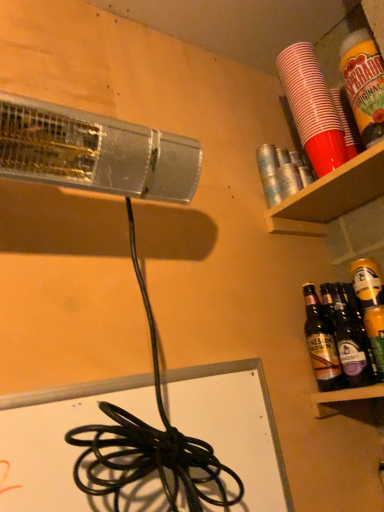
Image resolution: width=384 pixels, height=512 pixels. What do you see at coordinates (312, 108) in the screenshot?
I see `red plastic cups at upper right, which appears as the first beverage when viewed from the back` at bounding box center [312, 108].

This screenshot has height=512, width=384. Find the location of `gold matte can at right`. gold matte can at right is located at coordinates (367, 283).

What is the approximate width of red plastic cups at upper right?

The width of red plastic cups at upper right is 9.03 inches.

The height and width of the screenshot is (512, 384). What are the coordinates of `dark brown glass bottle at lower right, the 2th bottle in the left-to-right sequence` in the screenshot? It's located at (351, 342).

Where is `brown glass bottles at right, the 2th bottle when ordered from right to left`? The image size is (384, 512). brown glass bottles at right, the 2th bottle when ordered from right to left is located at coordinates (321, 344).

The image size is (384, 512). In order to click on red plastic cups at upper right, which appears as the first beverage when viewed from the back in this screenshot , I will do `click(312, 108)`.

From a real-world perspective, who is located lower, red plastic cups at upper right or gold matte can at right?

From a 3D spatial view, gold matte can at right is below.

Which of these two, red plastic cups at upper right or gold matte can at right, stands shorter?

With less height is red plastic cups at upper right.

How much distance is there between red plastic cups at upper right and gold matte can at right?

red plastic cups at upper right is 20.60 centimeters from gold matte can at right.

Which point is more distant from viewer, (315, 201) or (369, 298)?

Positioned behind is point (315, 201).

Is dark brown glass bottle at lower right, the 2th bottle in the left-to-right sequence, thinner than red plastic cups at upper right, the 2th beverage positioned from the front?

Yes.

Could you tell me if dark brown glass bottle at lower right, the 2th bottle in the left-to-right sequence, is turned towards red plastic cups at upper right, the 2th beverage positioned from the front?

No.

Which is in front, point (369, 377) or point (338, 137)?

The point (369, 377) is more forward.

Would you say dark brown glass bottle at lower right, the 2th bottle in the left-to-right sequence, is outside red plastic cups at upper right, the 2th beverage positioned from the front?

Absolutely, dark brown glass bottle at lower right, the 2th bottle in the left-to-right sequence, is external to red plastic cups at upper right, the 2th beverage positioned from the front.

Can you confirm if red plastic cups at upper right, the 2th beverage positioned from the front, is positioned to the left of red plastic cups at upper right?

Indeed, red plastic cups at upper right, the 2th beverage positioned from the front, is positioned on the left side of red plastic cups at upper right.

From the image's perspective, does red plastic cups at upper right, the 2th beverage positioned from the front, appear higher than red plastic cups at upper right?

Correct, red plastic cups at upper right, the 2th beverage positioned from the front, appears higher than red plastic cups at upper right in the image.

From the picture: Can you confirm if red plastic cups at upper right, the 2th beverage positioned from the front, is shorter than red plastic cups at upper right?

No, red plastic cups at upper right, the 2th beverage positioned from the front, is not shorter than red plastic cups at upper right.

Who is bigger, red plastic cups at upper right, the 2th beverage positioned from the front, or red plastic cups at upper right?

red plastic cups at upper right.

Does brown glass bottles at right, arranged as the first bottle when viewed from the left, have a lesser height compared to gold matte can at right?

No.

This screenshot has width=384, height=512. In the image, there is a brown glass bottles at right, the 2th bottle when ordered from right to left. What are the coordinates of `beer above it (from the image's perspective)` in the screenshot? It's located at point(367,283).

Does point (342, 383) come farther from viewer compared to point (382, 301)?

Yes, point (342, 383) is farther from viewer.

Does brown glass bottles at right, the 2th bottle when ordered from right to left, turn towards gold matte can at right?

No, brown glass bottles at right, the 2th bottle when ordered from right to left, is not facing towards gold matte can at right.

Considering the sizes of objects dark brown glass bottle at lower right, the first bottle from the right, and brown glass bottles at right, arranged as the first bottle when viewed from the left, in the image provided, who is wider, dark brown glass bottle at lower right, the first bottle from the right, or brown glass bottles at right, arranged as the first bottle when viewed from the left,?

With larger width is dark brown glass bottle at lower right, the first bottle from the right.

How much distance is there between dark brown glass bottle at lower right, the first bottle from the right, and brown glass bottles at right, arranged as the first bottle when viewed from the left?

The distance of dark brown glass bottle at lower right, the first bottle from the right, from brown glass bottles at right, arranged as the first bottle when viewed from the left, is 1.68 inches.

Based on the photo, from a real-world perspective, is dark brown glass bottle at lower right, the 2th bottle in the left-to-right sequence, below brown glass bottles at right, arranged as the first bottle when viewed from the left?

Yes, from a real-world perspective, dark brown glass bottle at lower right, the 2th bottle in the left-to-right sequence, is below brown glass bottles at right, arranged as the first bottle when viewed from the left.

Do you think gold matte can at right is within dark brown glass bottle at lower right, the first bottle from the right, or outside of it?

The correct answer is: outside.

From the image's perspective, is gold matte can at right above or below dark brown glass bottle at lower right, the 2th bottle in the left-to-right sequence?

From the image's perspective, gold matte can at right appears above dark brown glass bottle at lower right, the 2th bottle in the left-to-right sequence.

Is gold matte can at right looking in the opposite direction of dark brown glass bottle at lower right, the 2th bottle in the left-to-right sequence?

No.

Is gold matte can at right not close to dark brown glass bottle at lower right, the first bottle from the right?

No, gold matte can at right is not far away from dark brown glass bottle at lower right, the first bottle from the right.

Identify the location of shelf on the right of brown glass bottles at right, arranged as the first bottle when viewed from the left. (330, 196).

Is red plastic cups at upper right completely or partially outside of brown glass bottles at right, arranged as the first bottle when viewed from the left?

That's correct, red plastic cups at upper right is outside of brown glass bottles at right, arranged as the first bottle when viewed from the left.

Is the surface of red plastic cups at upper right in direct contact with brown glass bottles at right, arranged as the first bottle when viewed from the left?

No, red plastic cups at upper right is not next to brown glass bottles at right, arranged as the first bottle when viewed from the left.

The width and height of the screenshot is (384, 512). I want to click on shelf on the left of the gold matte can at right, so click(330, 196).

From a real-world perspective, starting from the red plastic cups at upper right, the 2th beverage positioned from the front, which bottle is the 2nd one below it? Please provide its 2D coordinates.

[(351, 342)]

Estimate the real-world distances between objects in this image. Which object is closer to dark brown glass bottle at lower right, the 2th bottle in the left-to-right sequence, red plastic cups at upper right, the 2th beverage positioned from the front, or gold matte can at right?

Among the two, gold matte can at right is located nearer to dark brown glass bottle at lower right, the 2th bottle in the left-to-right sequence.

When comparing their distances from orange plastic cup at upper right, the second beverage positioned from the back, does brown glass bottles at right, the 2th bottle when ordered from right to left, or red plastic cups at upper right seem further?

The object further to orange plastic cup at upper right, the second beverage positioned from the back, is brown glass bottles at right, the 2th bottle when ordered from right to left.

Looking at the image, which one is located further to gold matte can at right, brown glass bottles at right, arranged as the first bottle when viewed from the left, or red plastic cups at upper right, which appears as the first beverage when viewed from the back?

Among the two, red plastic cups at upper right, which appears as the first beverage when viewed from the back, is located further to gold matte can at right.

From the image, which object appears to be nearer to dark brown glass bottle at lower right, the 2th bottle in the left-to-right sequence, orange plastic cup at upper right, which is counted as the 1th beverage, starting from the front, or gold matte can at right?

gold matte can at right lies closer to dark brown glass bottle at lower right, the 2th bottle in the left-to-right sequence, than the other object.

Which object lies further to the anchor point gold matte can at right, orange plastic cup at upper right, the second beverage positioned from the back, or red plastic cups at upper right, which appears as the first beverage when viewed from the back?

red plastic cups at upper right, which appears as the first beverage when viewed from the back, lies further to gold matte can at right than the other object.

Estimate the real-world distances between objects in this image. Which object is further from dark brown glass bottle at lower right, the 2th bottle in the left-to-right sequence, orange plastic cup at upper right, the second beverage positioned from the back, or red plastic cups at upper right, the 2th beverage positioned from the front?

orange plastic cup at upper right, the second beverage positioned from the back, is positioned further to the anchor dark brown glass bottle at lower right, the 2th bottle in the left-to-right sequence.

Estimate the real-world distances between objects in this image. Which object is closer to brown glass bottles at right, the 2th bottle when ordered from right to left, gold matte can at right or red plastic cups at upper right, which appears as the first beverage when viewed from the back?

gold matte can at right lies closer to brown glass bottles at right, the 2th bottle when ordered from right to left, than the other object.

Looking at the image, which one is located closer to red plastic cups at upper right, red plastic cups at upper right, the 2th beverage positioned from the front, or gold matte can at right?

Among the two, red plastic cups at upper right, the 2th beverage positioned from the front, is located nearer to red plastic cups at upper right.

Identify the location of bottle between red plastic cups at upper right, the 2th beverage positioned from the front, and brown glass bottles at right, the 2th bottle when ordered from right to left, vertically. (351, 342).

Find the location of a particular element. This screenshot has width=384, height=512. beverage between orange plastic cup at upper right, the second beverage positioned from the back, and gold matte can at right in the up-down direction is located at coordinates (312, 108).

The width and height of the screenshot is (384, 512). In order to click on beverage that lies between orange plastic cup at upper right, the second beverage positioned from the back, and red plastic cups at upper right from top to bottom in this screenshot , I will do `click(312, 108)`.

Where is `beverage that lies between orange plastic cup at upper right, the second beverage positioned from the back, and dark brown glass bottle at lower right, the 2th bottle in the left-to-right sequence, from top to bottom`? This screenshot has width=384, height=512. beverage that lies between orange plastic cup at upper right, the second beverage positioned from the back, and dark brown glass bottle at lower right, the 2th bottle in the left-to-right sequence, from top to bottom is located at coordinates (312, 108).